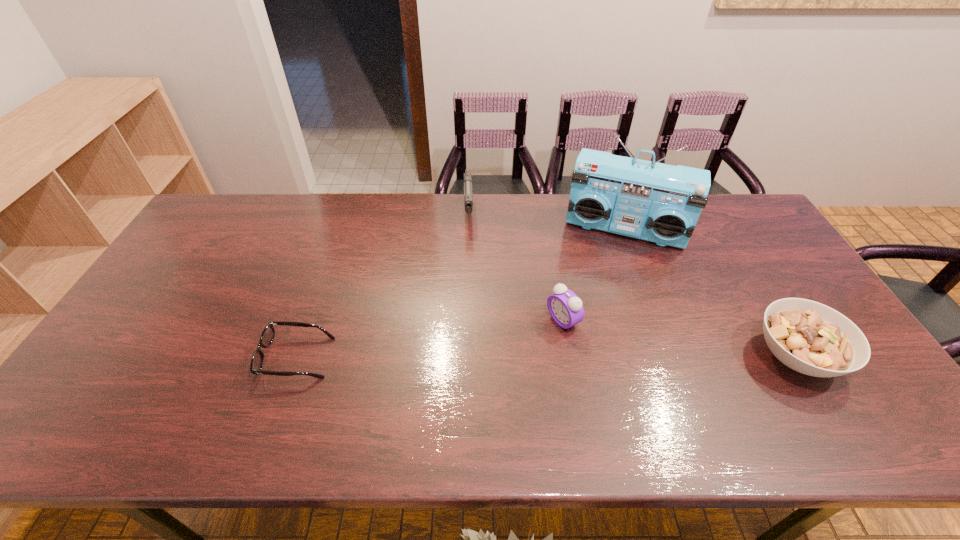
Locate which object ranks in proximity to the gun. Please provide its 2D coordinates. Your answer should be formatted as a tuple, i.e. [(x, y)], where the tuple contains the x and y coordinates of a point satisfying the conditions above.

[(661, 204)]

Find the location of `free location that satisfies the following two spatial constraints: 1. on the back side of the tallest object; 2. on the right side of the third object from right to left`. free location that satisfies the following two spatial constraints: 1. on the back side of the tallest object; 2. on the right side of the third object from right to left is located at coordinates (547, 230).